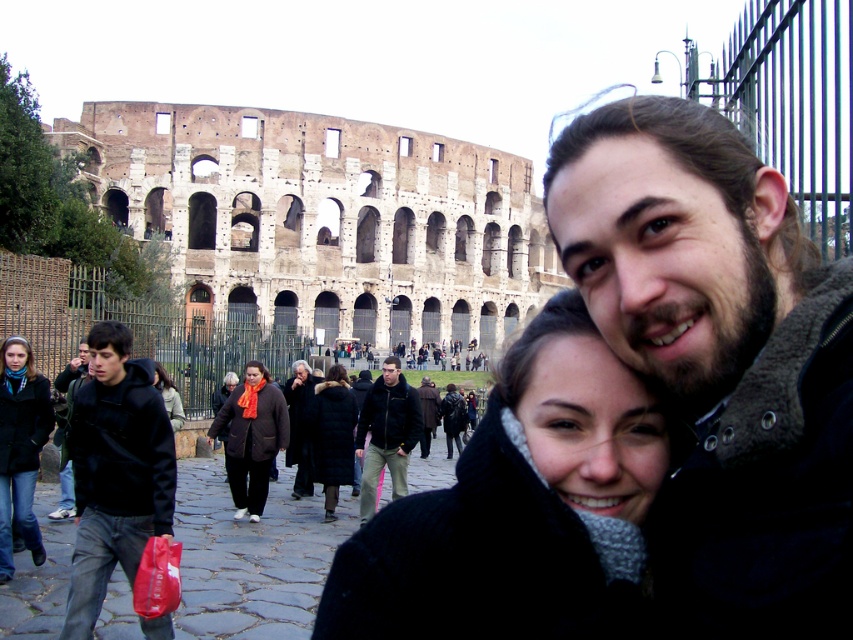
Which is below, black matte jacket at left or dark brown leather jacket at center?

black matte jacket at left is lower down.

Image resolution: width=853 pixels, height=640 pixels. I want to click on black matte jacket at left, so click(x=115, y=472).

The image size is (853, 640). In order to click on black matte jacket at left in this screenshot , I will do `click(115, 472)`.

Between denim jacket at lower left and dark blue jeans at center, which one appears on the right side from the viewer's perspective?

dark blue jeans at center is more to the right.

Who is taller, denim jacket at lower left or dark blue jeans at center?

Standing taller between the two is denim jacket at lower left.

Is point (42, 413) closer to camera compared to point (85, 356)?

Yes, it is.

Find the location of `denim jacket at lower left`. denim jacket at lower left is located at coordinates (20, 448).

Is point (107, 330) positioned before point (171, 397)?

Yes, point (107, 330) is in front of point (171, 397).

In the scene shown: Does black matte jacket at left appear under dark brown leather coat at center?

Correct, black matte jacket at left is located below dark brown leather coat at center.

Does point (88, 432) come in front of point (177, 400)?

That is True.

Image resolution: width=853 pixels, height=640 pixels. Identify the location of black matte jacket at left. (115, 472).